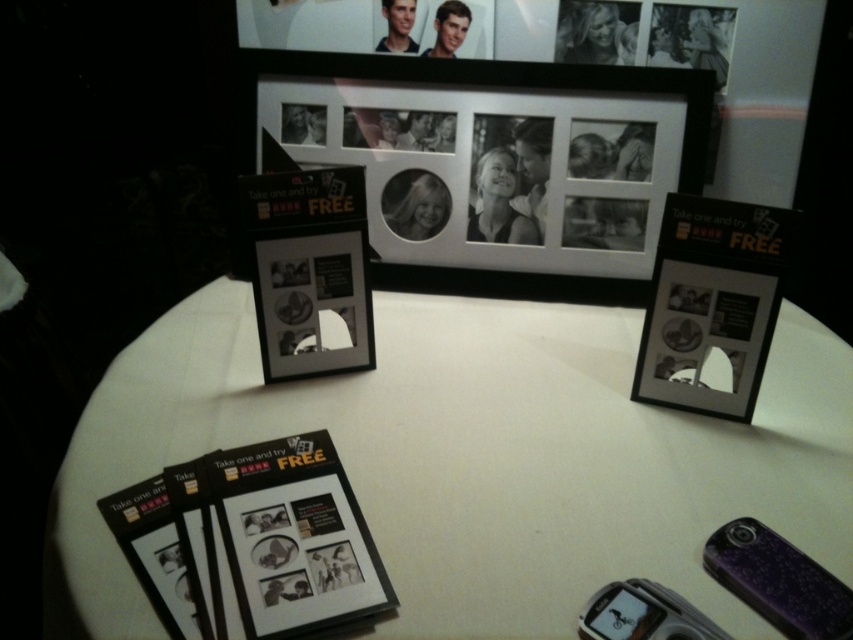
Question: Does white matte table at center have a smaller size compared to matte plastic picture frame at center?

Choices:
 (A) no
 (B) yes

Answer: (A)

Question: Among these objects, which one is nearest to the camera?

Choices:
 (A) white matte table at center
 (B) matte plastic picture frame at center

Answer: (A)

Question: Can you confirm if black matte picture frame at upper center is thinner than matte plastic picture frame at center?

Choices:
 (A) no
 (B) yes

Answer: (A)

Question: Is white matte table at center to the right of black matte picture frame at upper center from the viewer's perspective?

Choices:
 (A) yes
 (B) no

Answer: (A)

Question: Which of the following is the closest to the observer?

Choices:
 (A) (438, 372)
 (B) (642, 204)
 (C) (288, 356)

Answer: (C)

Question: Which object is closer to the camera taking this photo?

Choices:
 (A) matte plastic picture frame at center
 (B) black matte picture frame at upper center

Answer: (A)